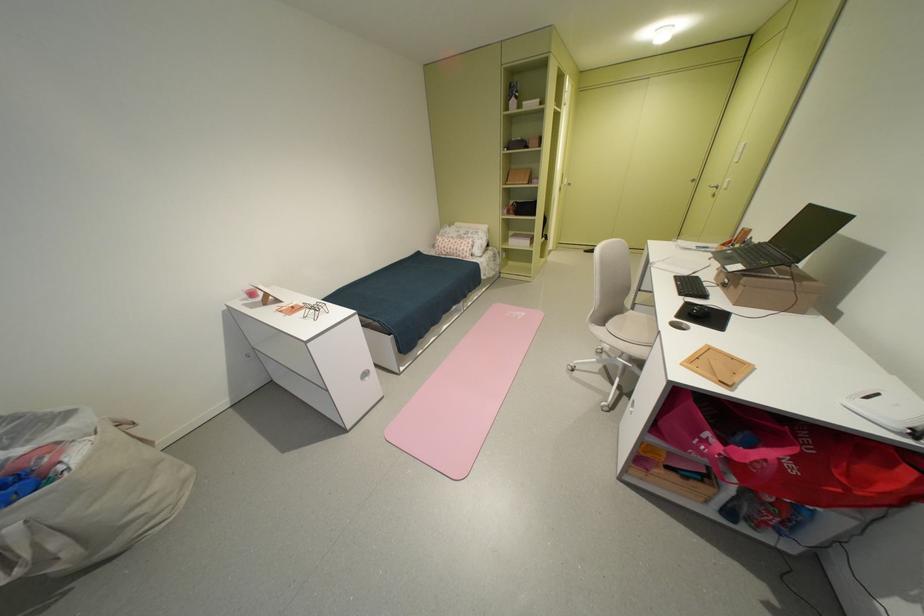
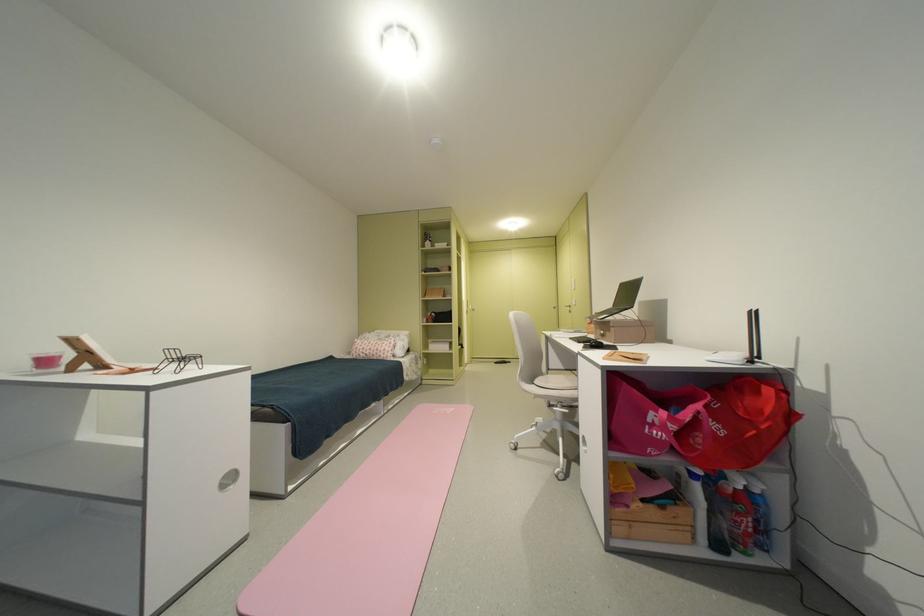
Locate, in the second image, the point that corresponds to pixel 713 448 in the first image.

(665, 432)